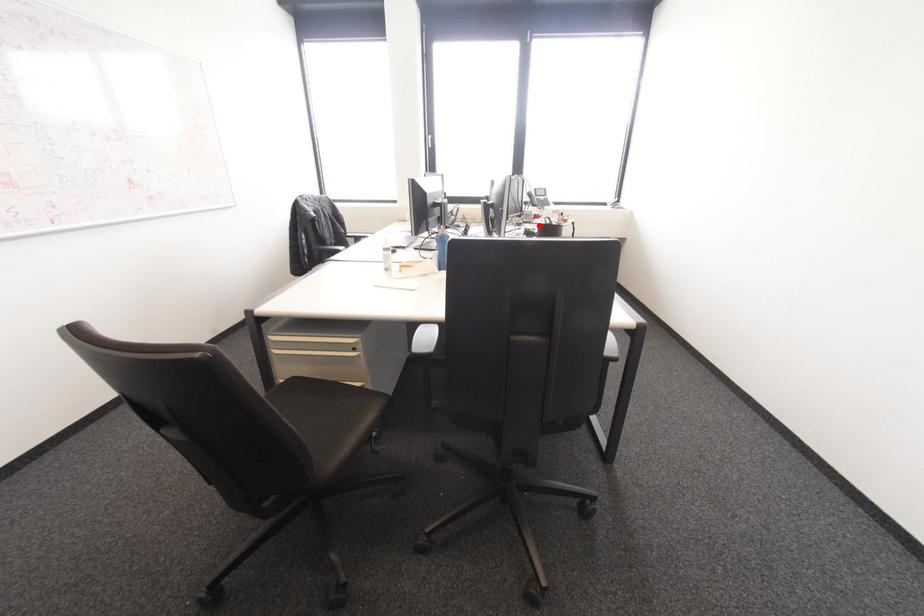
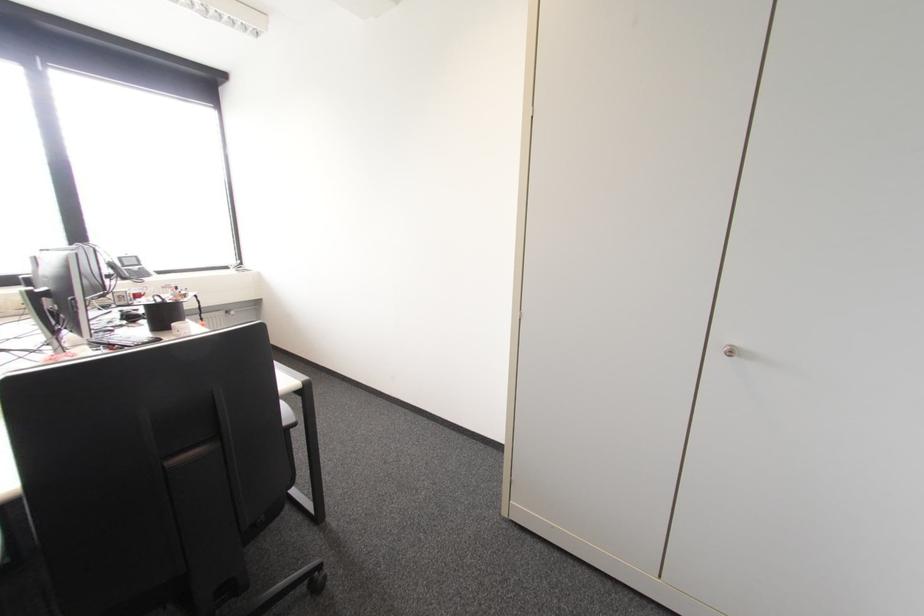
In the second image, find the point that corresponds to the highlighted location in the first image.

(148, 306)